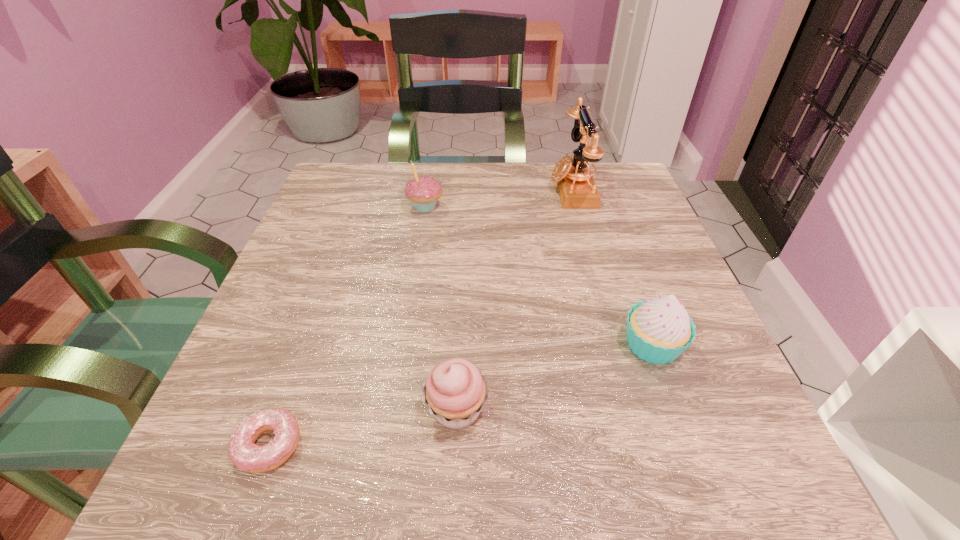
Where is `free space located 0.350m on the dial of the tallest object`? Image resolution: width=960 pixels, height=540 pixels. free space located 0.350m on the dial of the tallest object is located at coordinates (403, 188).

The width and height of the screenshot is (960, 540). I want to click on vacant space situated 0.280m on the dial of the tallest object, so click(432, 188).

You are a GUI agent. You are given a task and a screenshot of the screen. Output one action in this format:
    pyautogui.click(x=<x>, y=<y>)
    Task: Click on the free spot located 0.390m on the right of the second object from left to right
    
    Given the screenshot: What is the action you would take?
    pyautogui.click(x=617, y=207)

Where is `blank area located on the back of the second farthest cupcake`? This screenshot has width=960, height=540. blank area located on the back of the second farthest cupcake is located at coordinates (625, 270).

At what (x,y) coordinates should I click in order to perform the action: click on vacant space located 0.340m on the right of the nearest cupcake. Please return your answer as a coordinate pair (x, y). This screenshot has width=960, height=540. Looking at the image, I should click on (731, 409).

This screenshot has width=960, height=540. Find the location of `free spot located 0.280m on the right of the shortest object`. free spot located 0.280m on the right of the shortest object is located at coordinates (512, 445).

This screenshot has height=540, width=960. I want to click on telephone that is at the far edge, so click(x=577, y=190).

What are the coordinates of `cupcake located in the far edge section of the desktop` in the screenshot? It's located at (423, 191).

You are a GUI agent. You are given a task and a screenshot of the screen. Output one action in this format:
    pyautogui.click(x=<x>, y=<y>)
    Task: Click on the cupcake located at the near edge
    This screenshot has width=960, height=540.
    Given the screenshot: What is the action you would take?
    pyautogui.click(x=455, y=391)

At what (x,y) coordinates should I click in order to perform the action: click on doughnut that is at the near edge. Please return your answer as a coordinate pair (x, y). Looking at the image, I should click on click(243, 452).